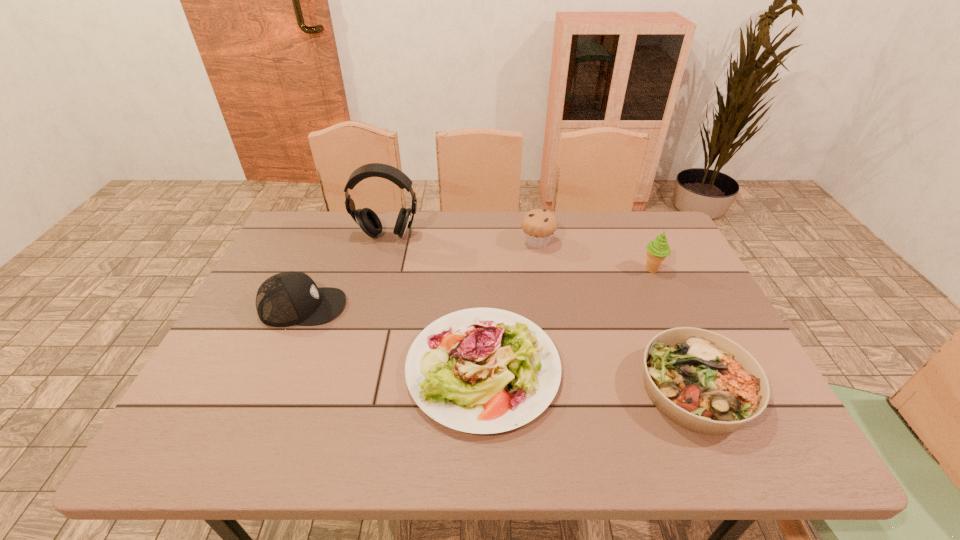
This screenshot has width=960, height=540. I want to click on blank region between the right salad plate and the left salad plate, so click(x=589, y=379).

Image resolution: width=960 pixels, height=540 pixels. Find the location of `unoccupied area between the left salad plate and the right salad plate`. unoccupied area between the left salad plate and the right salad plate is located at coordinates (589, 379).

Find the location of a particular element. The image size is (960, 540). unoccupied area between the right salad plate and the left salad plate is located at coordinates (589, 379).

Image resolution: width=960 pixels, height=540 pixels. I want to click on vacant space that's between the right salad plate and the left salad plate, so click(589, 379).

At what (x,y) coordinates should I click in order to perform the action: click on vacant point located between the tallest object and the icecream. Please return your answer as a coordinate pair (x, y). The width and height of the screenshot is (960, 540). Looking at the image, I should click on [x=519, y=253].

Choose which object is the nearest neighbor to the muffin. Please provide its 2D coordinates. Your answer should be formatted as a tuple, i.e. [(x, y)], where the tuple contains the x and y coordinates of a point satisfying the conditions above.

[(657, 250)]

Identify the location of the closest object to the cap. This screenshot has width=960, height=540. (481, 370).

Where is `vacant space that satisfies the following two spatial constraints: 1. on the front side of the fifth shortest object; 2. on the front-facing side of the cap`? The image size is (960, 540). vacant space that satisfies the following two spatial constraints: 1. on the front side of the fifth shortest object; 2. on the front-facing side of the cap is located at coordinates (669, 307).

In order to click on vacant space that satisfies the following two spatial constraints: 1. on the front-facing side of the cap; 2. on the right side of the right salad plate in this screenshot , I will do `click(267, 389)`.

Where is `vacant space that satisfies the following two spatial constraints: 1. on the back side of the left salad plate; 2. on the front-facing side of the cap`? The width and height of the screenshot is (960, 540). vacant space that satisfies the following two spatial constraints: 1. on the back side of the left salad plate; 2. on the front-facing side of the cap is located at coordinates (483, 307).